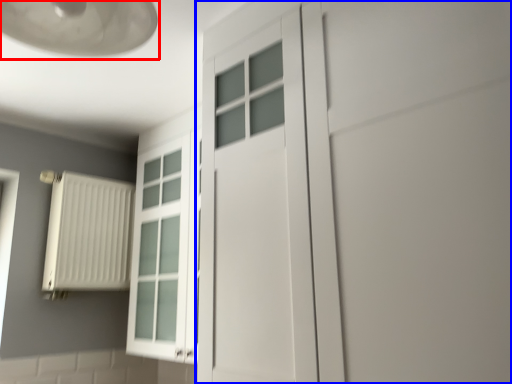
Question: Which object appears farthest to the camera in this image, lamp (highlighted by a red box) or door (highlighted by a blue box)?

Choices:
 (A) lamp
 (B) door

Answer: (B)